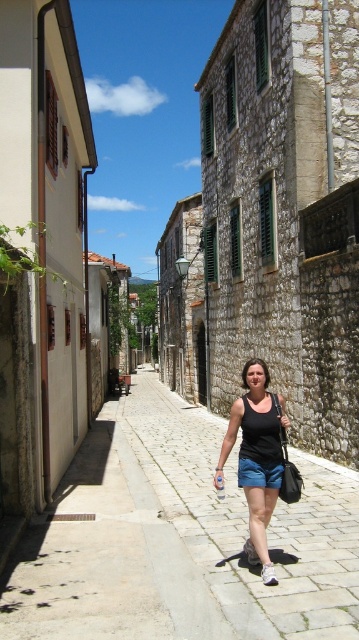
You are a photographer standing on the gray cobblestone pavement at center and want to take a photo of the black fabric tank top at center. Which object is closer to the camera lens?

The black fabric tank top at center is closer to the camera lens because it is positioned above the gray cobblestone pavement at center, which is located below it.

You are a tourist standing at the entrance of the cobblestone street. You want to take a photo of the gray cobblestone pavement at center. Where should you position yourself to capture it in the frame?

The gray cobblestone pavement at center is located at point [246,522], so you should position yourself facing the center of the street to capture it in the frame.